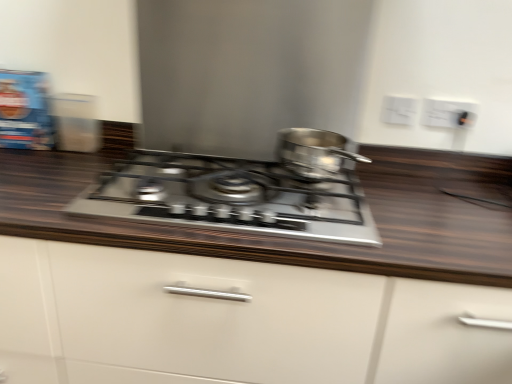
Question: Considering the positions of satin silver gas stove at center and white matte cabinet at center in the image, is satin silver gas stove at center bigger or smaller than white matte cabinet at center?

Choices:
 (A) small
 (B) big

Answer: (A)

Question: From their relative heights in the image, would you say satin silver gas stove at center is taller or shorter than white matte cabinet at center?

Choices:
 (A) tall
 (B) short

Answer: (B)

Question: Which object is the farthest from the satin silver pot at center?

Choices:
 (A) satin silver gas stove at center
 (B) white plastic electric outlet at upper right, which is the 2th electric outlet in right-to-left order
 (C) white matte cabinet at center
 (D) white plastic electric outlet at upper right, positioned as the 1th electric outlet in right-to-left order

Answer: (C)

Question: Which of these objects is positioned closest to the white matte cabinet at center?

Choices:
 (A) white plastic electric outlet at upper right, acting as the second electric outlet starting from the left
 (B) white plastic electric outlet at upper right, arranged as the first electric outlet when viewed from the left
 (C) satin silver gas stove at center
 (D) satin silver pot at center

Answer: (C)